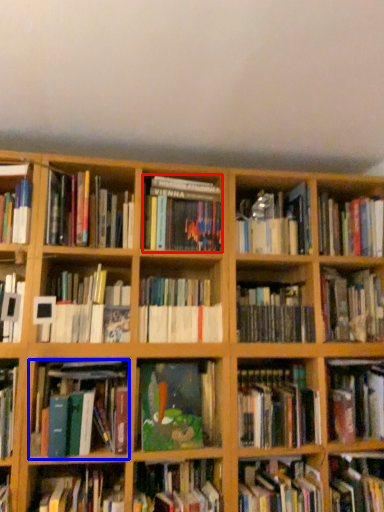
Question: Which object is closer to the camera taking this photo, book (highlighted by a red box) or book (highlighted by a blue box)?

Choices:
 (A) book
 (B) book

Answer: (B)